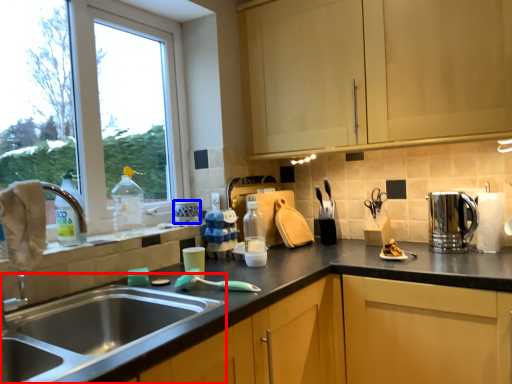
Question: Which object is further to the camera taking this photo, sink (highlighted by a red box) or appliance (highlighted by a blue box)?

Choices:
 (A) sink
 (B) appliance

Answer: (B)